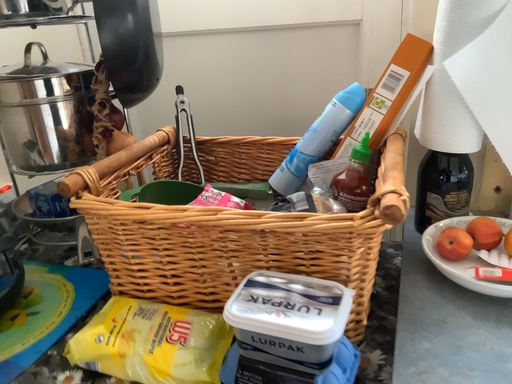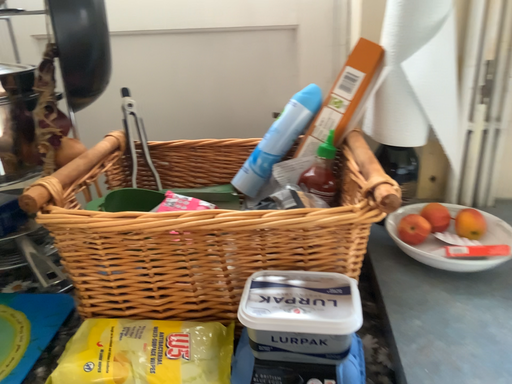
Question: How did the camera likely rotate when shooting the video?

Choices:
 (A) rotated left
 (B) rotated right

Answer: (B)